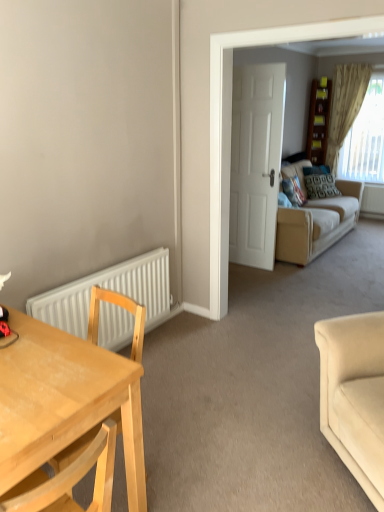
Question: Is point (370, 75) positioned closer to the camera than point (321, 194)?

Choices:
 (A) closer
 (B) farther

Answer: (B)

Question: In terms of width, does beige textured curtain at upper right look wider or thinner when compared to patterned fabric pillow at center, the second pillow when ordered from front to back?

Choices:
 (A) wide
 (B) thin

Answer: (B)

Question: Estimate the real-world distances between objects in this image. Which object is farther from the light wood desk at left?

Choices:
 (A) white matte radiator at lower left
 (B) beige fabric couch at right, which is counted as the 1th studio couch, starting from the front
 (C) velvet blue pillow at center-right, which is the second pillow in back-to-front order
 (D) wooden bookshelf at upper right
 (E) white matte door at center

Answer: (D)

Question: Estimate the real-world distances between objects in this image. Which object is closer to the white matte radiator at lower left?

Choices:
 (A) white matte door at center
 (B) beige fabric couch at right, the first studio couch when ordered from back to front
 (C) velvet blue pillow at center-right, positioned as the 1th pillow in front-to-back order
 (D) light wood desk at left
 (E) patterned fabric pillow at center, the second pillow when ordered from front to back

Answer: (D)